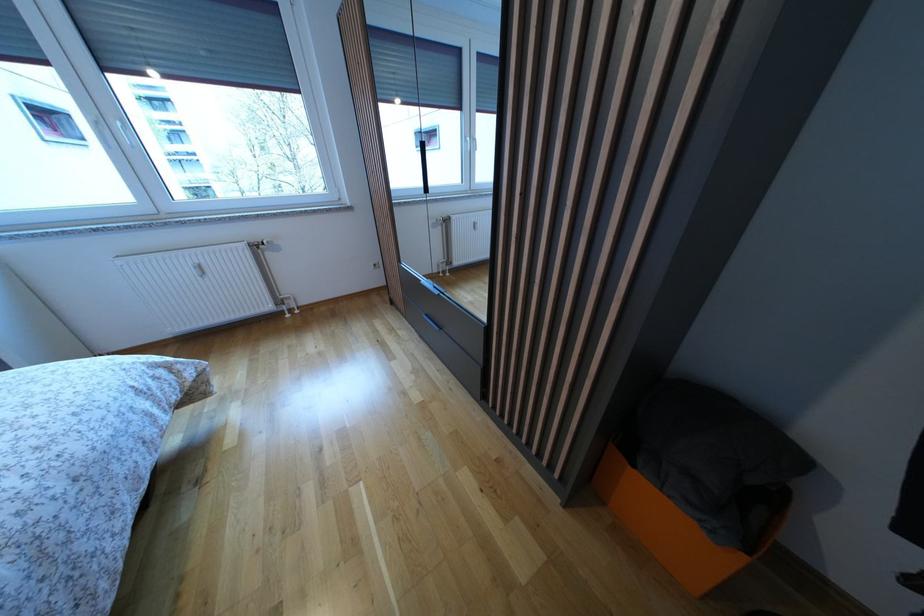
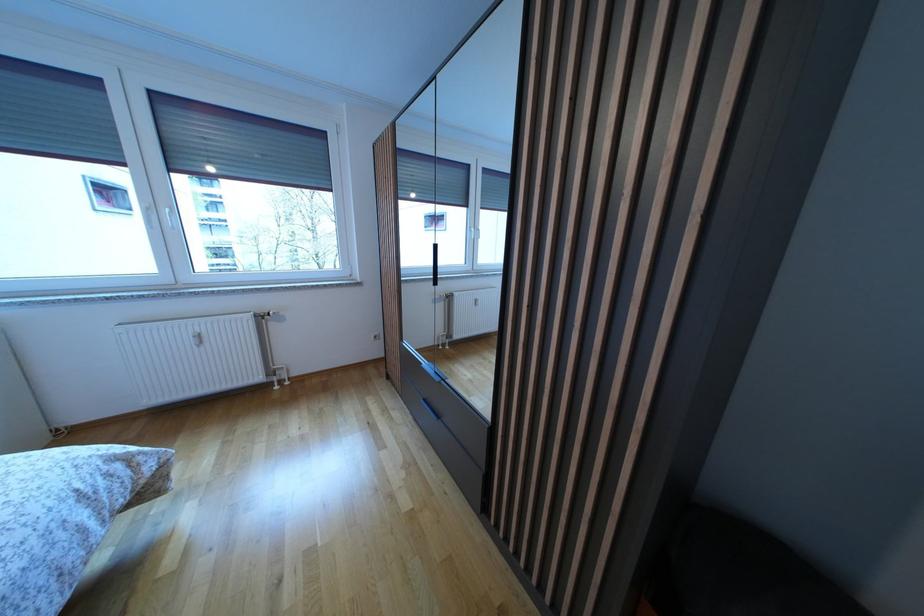
Question: Which direction would the cameraman need to move to produce the second image? Reply with the corresponding letter.

Choices:
 (A) Left
 (B) Right
 (C) Forward
 (D) Backward

Answer: (A)